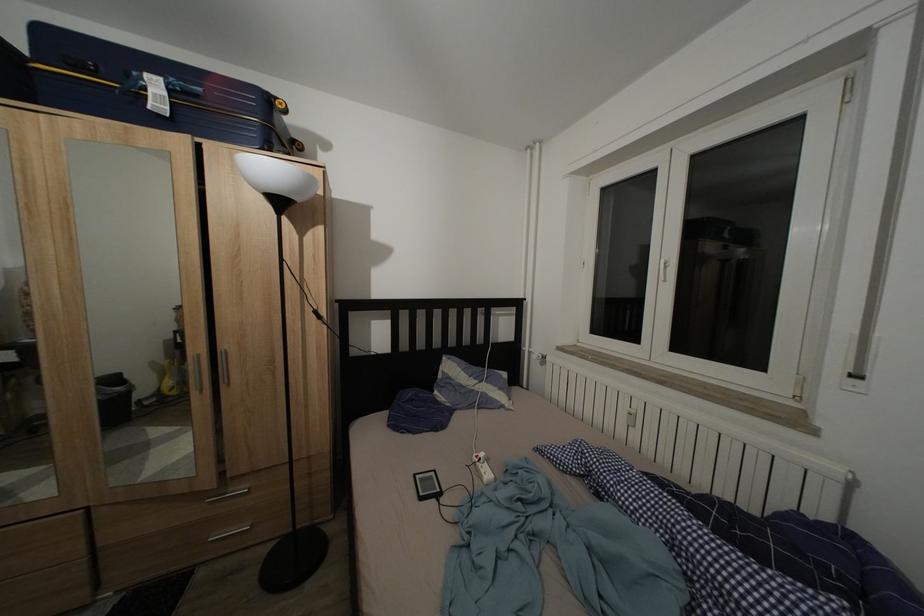
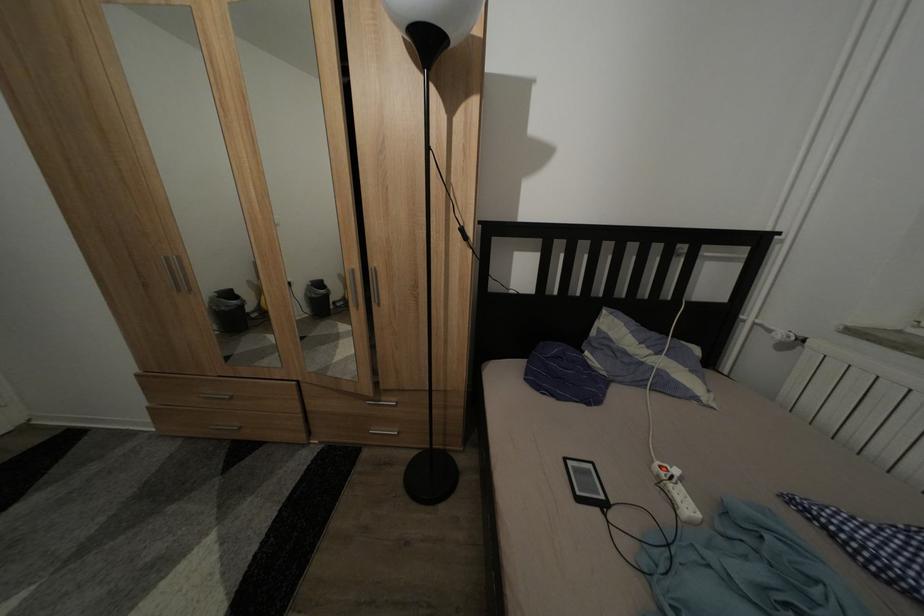
Question: The camera is either moving clockwise (left) or counter-clockwise (right) around the object. The first image is from the beginning of the video and the second image is from the end. Is the camera moving left or right when shooting the video?

Choices:
 (A) Left
 (B) Right

Answer: (B)